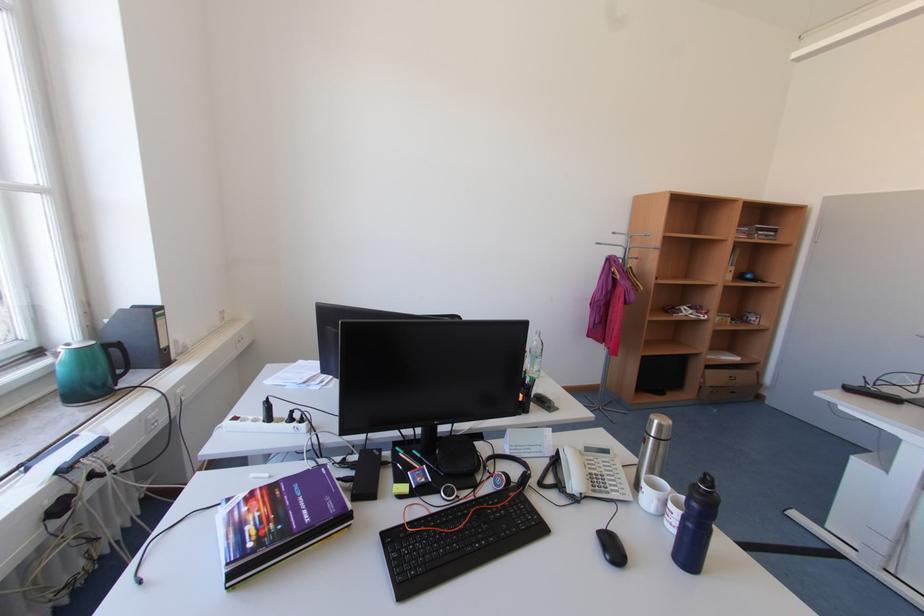
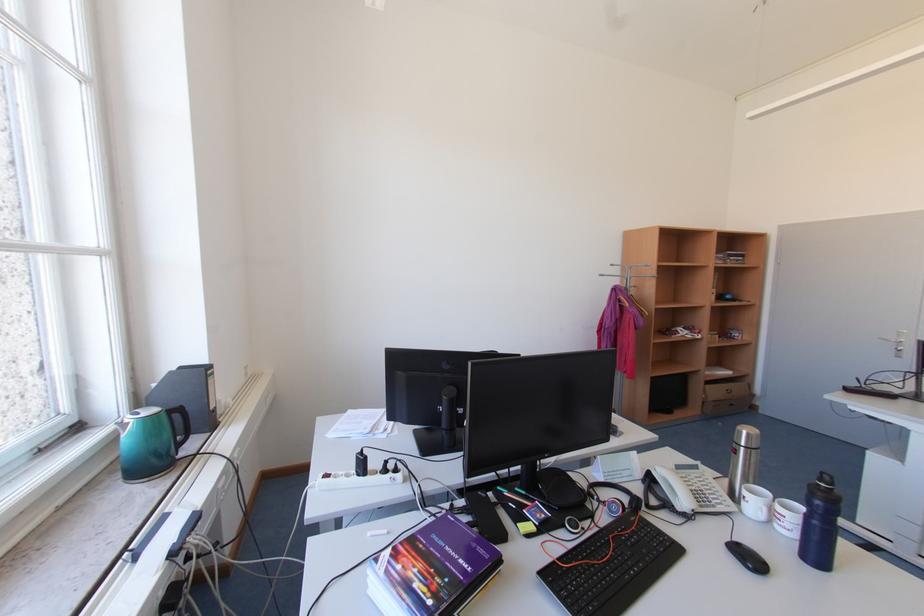
Locate, in the second image, the point that corresponds to pixel 661 421 in the first image.

(748, 432)